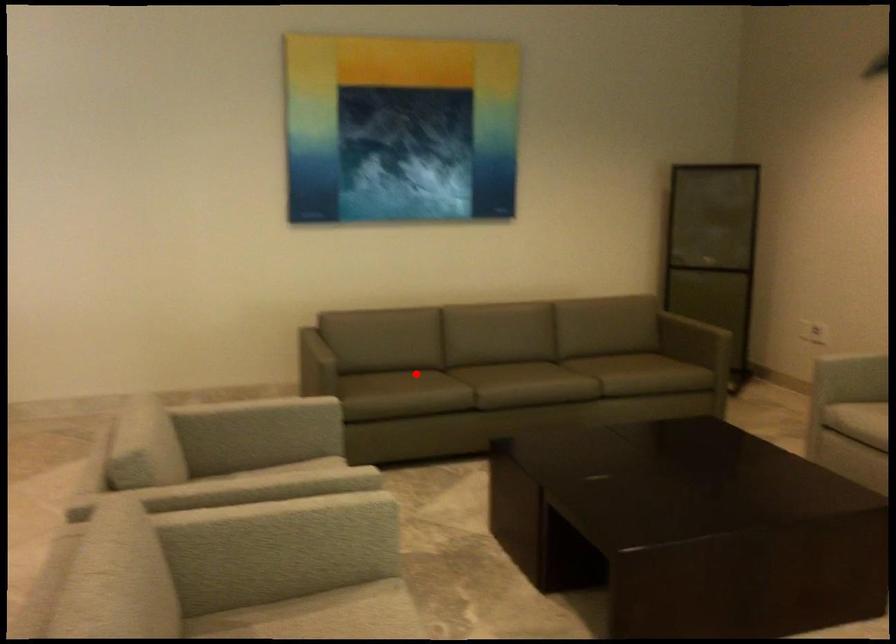
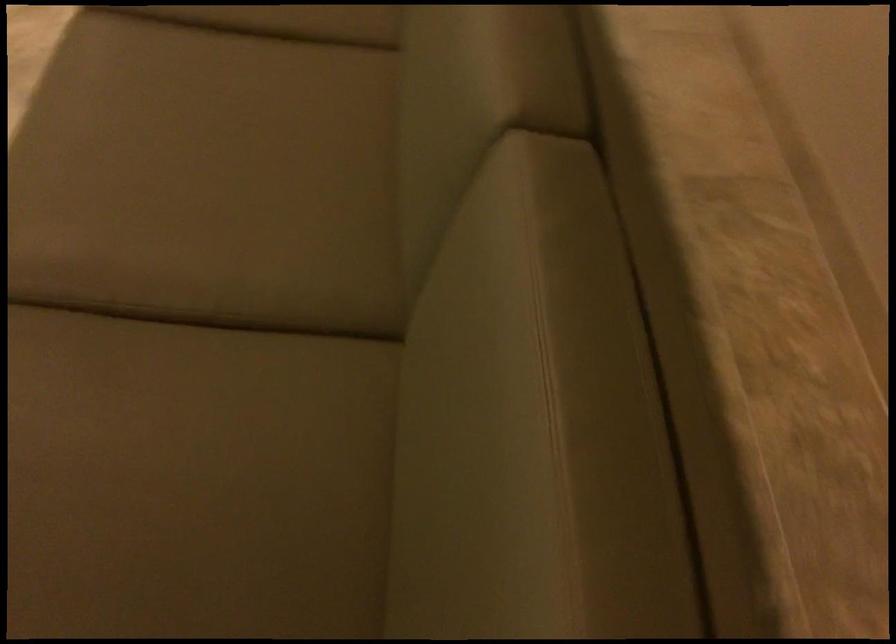
Locate, in the second image, the point that corresponds to the highlighted location in the first image.

(286, 20)